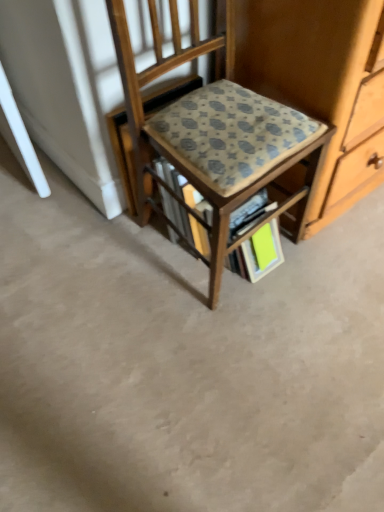
Question: Could you tell me if patterned fabric chair at center is facing bright green paper at lower center?

Choices:
 (A) no
 (B) yes

Answer: (B)

Question: Does patterned fabric chair at center have a lesser height compared to bright green paper at lower center?

Choices:
 (A) no
 (B) yes

Answer: (A)

Question: Can you confirm if patterned fabric chair at center is taller than bright green paper at lower center?

Choices:
 (A) no
 (B) yes

Answer: (B)

Question: Is patterned fabric chair at center facing away from bright green paper at lower center?

Choices:
 (A) no
 (B) yes

Answer: (A)

Question: Is the position of patterned fabric chair at center less distant than that of bright green paper at lower center?

Choices:
 (A) no
 (B) yes

Answer: (B)

Question: From the image's perspective, is patterned fabric chair at center below bright green paper at lower center?

Choices:
 (A) yes
 (B) no

Answer: (B)

Question: Is bright green paper at lower center oriented away from patterned fabric chair at center?

Choices:
 (A) no
 (B) yes

Answer: (B)

Question: Is bright green paper at lower center surrounding patterned fabric chair at center?

Choices:
 (A) yes
 (B) no

Answer: (B)

Question: Is bright green paper at lower center touching patterned fabric chair at center?

Choices:
 (A) yes
 (B) no

Answer: (B)

Question: Is bright green paper at lower center located outside patterned fabric chair at center?

Choices:
 (A) yes
 (B) no

Answer: (B)

Question: From a real-world perspective, is bright green paper at lower center over patterned fabric chair at center?

Choices:
 (A) yes
 (B) no

Answer: (B)

Question: Does bright green paper at lower center have a lesser width compared to patterned fabric chair at center?

Choices:
 (A) yes
 (B) no

Answer: (A)

Question: Does patterned fabric chair at center have a greater height compared to patterned fabric book at center?

Choices:
 (A) yes
 (B) no

Answer: (A)